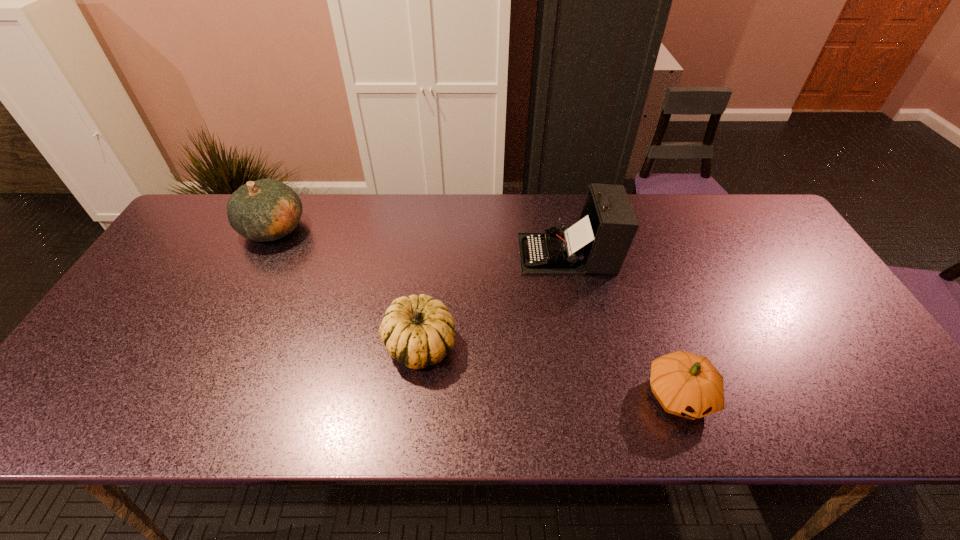
Point out which object is positioned as the nearest to the tallest object. Please provide its 2D coordinates. Your answer should be formatted as a tuple, i.e. [(x, y)], where the tuple contains the x and y coordinates of a point satisfying the conditions above.

[(418, 331)]

Locate an element on the screen. The image size is (960, 540). object that is the third nearest to the leftmost gourd is located at coordinates (688, 385).

Find the location of `gourd that is the third closest to the typewriter`. gourd that is the third closest to the typewriter is located at coordinates (263, 210).

This screenshot has height=540, width=960. Find the location of `gourd that stands as the closest to the second object from left to right`. gourd that stands as the closest to the second object from left to right is located at coordinates (263, 210).